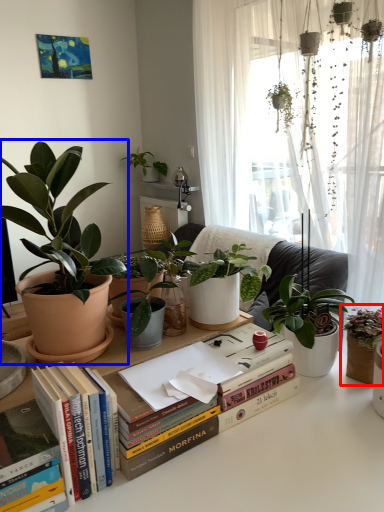
Question: Which object is closer to the camera taking this photo, houseplant (highlighted by a red box) or houseplant (highlighted by a blue box)?

Choices:
 (A) houseplant
 (B) houseplant

Answer: (B)